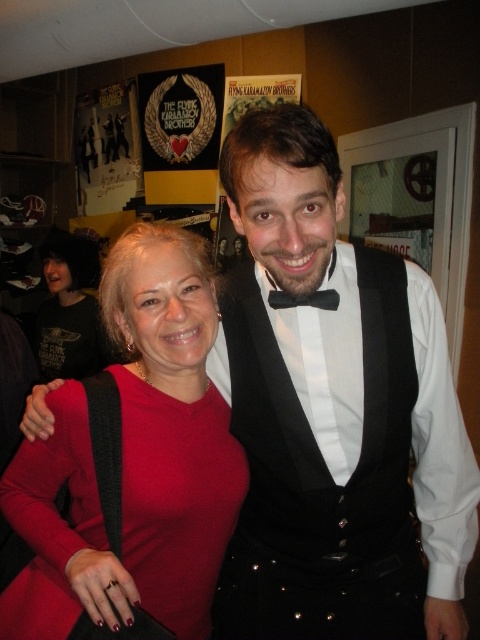
You are designing a gift box that needs to accommodate both the matte red sweater at center and the black satin bow tie at center. What should be the minimum size of the box to ensure both items fit comfortably?

The matte red sweater at center is bigger than the black satin bow tie at center, so the box should be sized to accommodate the larger item, the matte red sweater at center, ensuring both items fit comfortably.

You are a photographer setting up for a portrait session. You have two focal points in the image, the matte red sweater at center and the black satin bow tie at center. Which object should you focus on if you want to capture the one that is physically closer to the camera?

The matte red sweater at center is closer to the viewer than the black satin bow tie at center, so you should focus on the matte red sweater at center to capture the object that is physically closer to the camera.